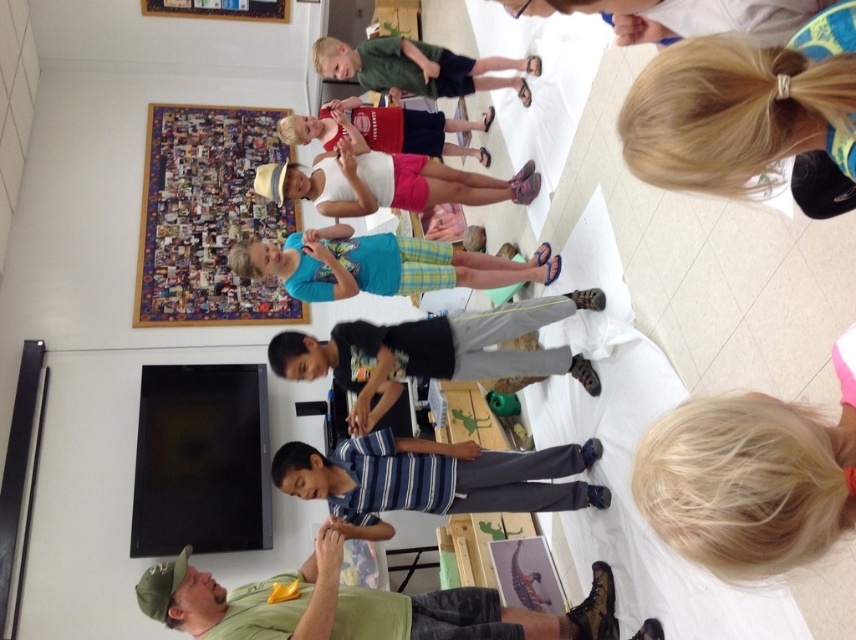
You are a photographer trying to capture a group photo of the green matte shirt at upper center and the matte red shirt at center. The camera you are using has a maximum focus range of 12 inches. Will both subjects be in focus?

The green matte shirt at upper center and the matte red shirt at center are 12.26 inches apart. Since the distance between them exceeds the camera maximum focus range of 12 inches, the photographer might struggle to have both in focus simultaneously.

You are standing in the classroom and see two points marked on the floor. The first point is at coordinate point (415,49) and the second is at point (385,106). Which point is closer to you?

Point (415,49) is closer to the viewer than point (385,106).